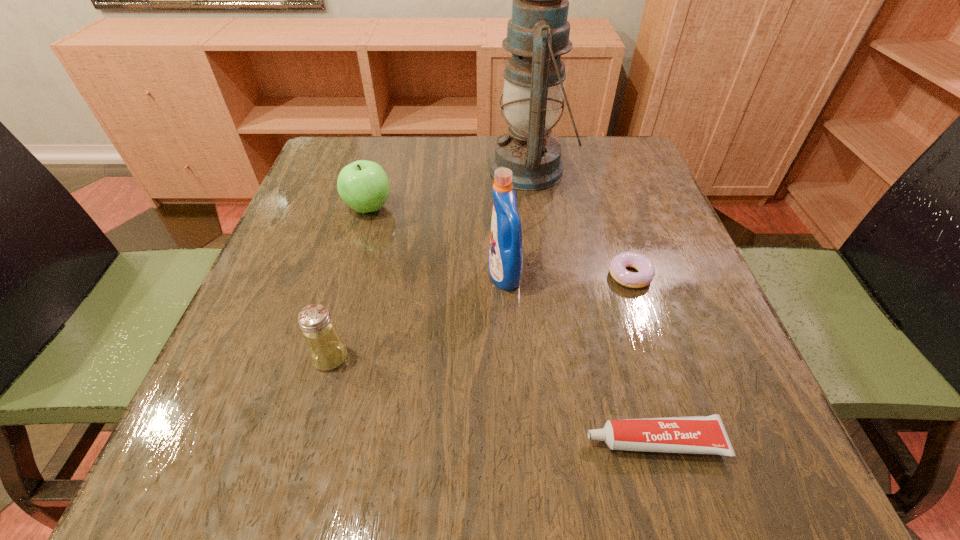
Find the location of a particular element. The width and height of the screenshot is (960, 540). the tallest object is located at coordinates (538, 33).

The width and height of the screenshot is (960, 540). I want to click on the fifth shortest object, so click(505, 261).

Locate an element on the screen. The width and height of the screenshot is (960, 540). apple is located at coordinates point(363,185).

Locate an element on the screen. Image resolution: width=960 pixels, height=540 pixels. the fifth farthest object is located at coordinates (326, 349).

At what (x,y) coordinates should I click in order to perform the action: click on toothpaste. Please return your answer as a coordinate pair (x, y). The height and width of the screenshot is (540, 960). Looking at the image, I should click on (706, 434).

At what (x,y) coordinates should I click in order to perform the action: click on the second shortest object. Please return your answer as a coordinate pair (x, y). Looking at the image, I should click on (706, 434).

I want to click on the shortest object, so click(644, 276).

The height and width of the screenshot is (540, 960). In order to click on free space located on the right of the oil lamp in this screenshot , I will do coord(625,170).

I want to click on free location located 0.220m on the label of the detergent, so click(371, 275).

What are the coordinates of `blank space located on the label of the detergent` in the screenshot? It's located at click(x=345, y=275).